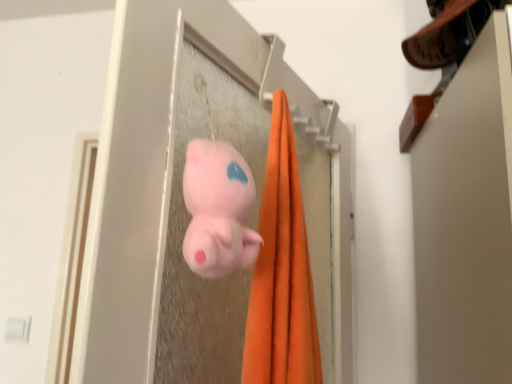
Question: Is fluffy pink plush at center wider or thinner than pink plush toy at center?

Choices:
 (A) thin
 (B) wide

Answer: (A)

Question: Considering the positions of fluffy pink plush at center and pink plush toy at center in the image, is fluffy pink plush at center bigger or smaller than pink plush toy at center?

Choices:
 (A) small
 (B) big

Answer: (A)

Question: Does point (203, 185) appear closer or farther from the camera than point (201, 125)?

Choices:
 (A) farther
 (B) closer

Answer: (B)

Question: Considering the relative positions of pink plush toy at center and fluffy pink plush at center in the image provided, is pink plush toy at center to the left or to the right of fluffy pink plush at center?

Choices:
 (A) left
 (B) right

Answer: (B)

Question: Is pink plush toy at center spatially inside fluffy pink plush at center, or outside of it?

Choices:
 (A) inside
 (B) outside

Answer: (B)

Question: Considering the positions of pink plush toy at center and fluffy pink plush at center in the image, is pink plush toy at center wider or thinner than fluffy pink plush at center?

Choices:
 (A) thin
 (B) wide

Answer: (B)

Question: From their relative heights in the image, would you say pink plush toy at center is taller or shorter than fluffy pink plush at center?

Choices:
 (A) tall
 (B) short

Answer: (A)